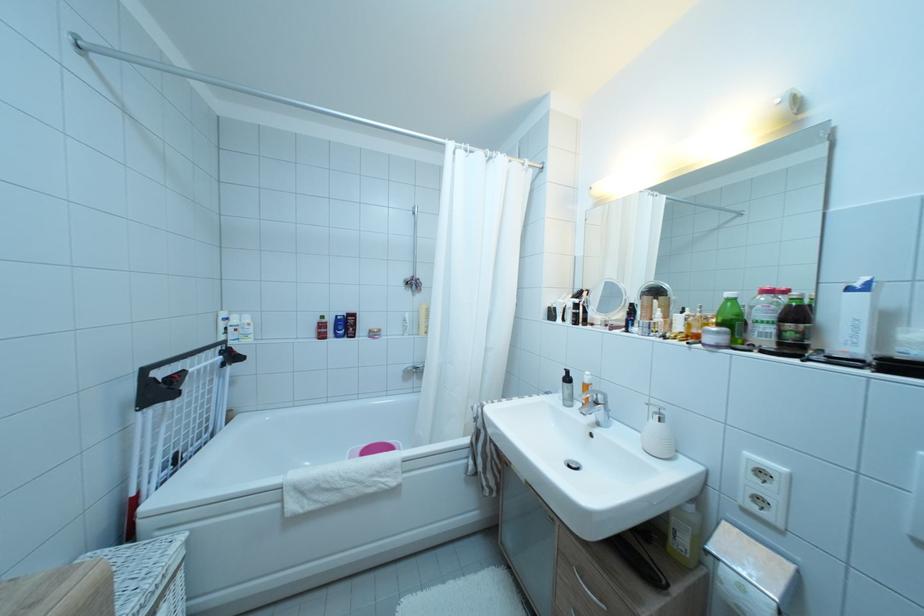
This screenshot has height=616, width=924. What are the coordinates of `red shampoo bottle` in the screenshot? It's located at (332, 328).